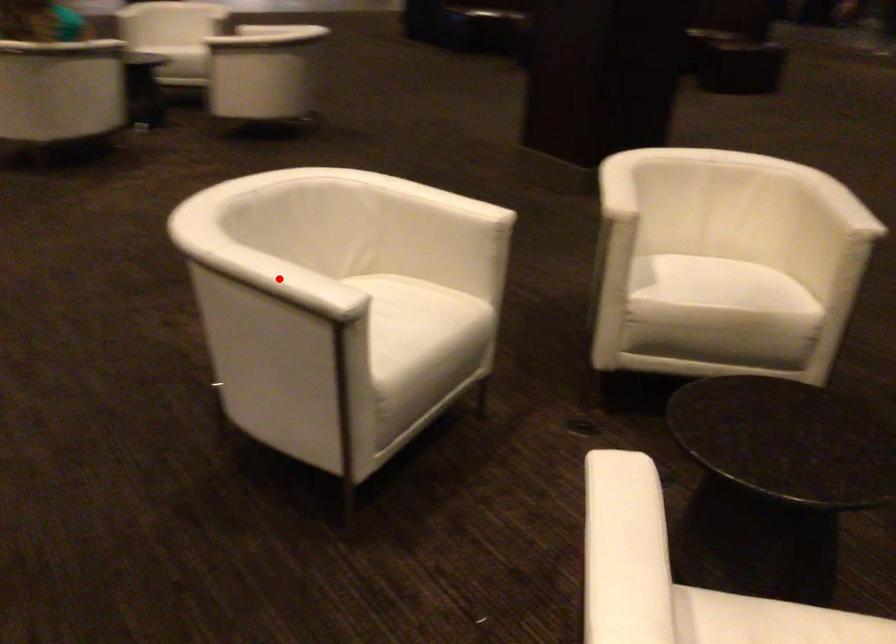
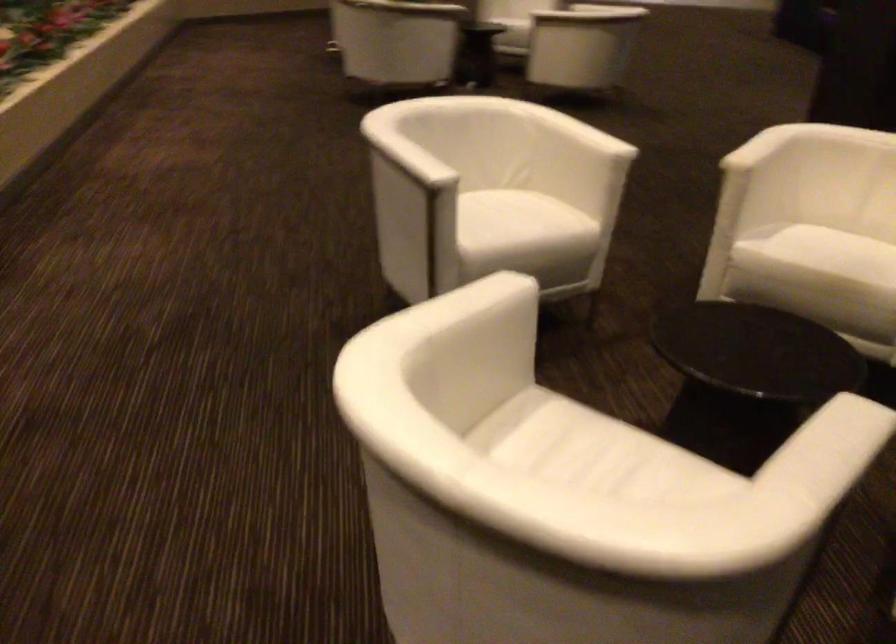
Question: I am providing you with two images of the same scene from different viewpoints. Image1 has a red point marked. In image2, the corresponding 3D location appears at what relative position? Reply with the corresponding letter.

Choices:
 (A) Closer
 (B) Farther

Answer: (B)